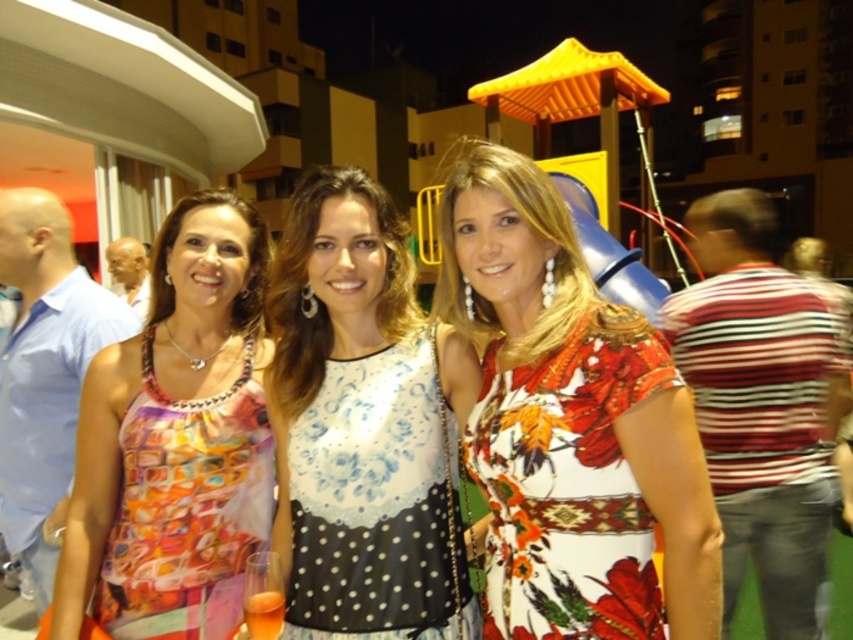
Is multicolored printed dress at center smaller than white lace tank top at center?

Incorrect, multicolored printed dress at center is not smaller in size than white lace tank top at center.

Between multicolored printed dress at center and white lace tank top at center, which one is positioned higher?

Positioned higher is multicolored printed dress at center.

Is point (78, 472) behind point (421, 388)?

Yes, point (78, 472) is farther from viewer.

Identify the location of multicolored printed dress at center. Image resolution: width=853 pixels, height=640 pixels. (177, 442).

Is point (474, 212) positioned before point (219, 598)?

That is True.

The width and height of the screenshot is (853, 640). What do you see at coordinates (569, 424) in the screenshot? I see `floral print dress at center` at bounding box center [569, 424].

Image resolution: width=853 pixels, height=640 pixels. Describe the element at coordinates (569, 424) in the screenshot. I see `floral print dress at center` at that location.

In order to click on floral print dress at center in this screenshot , I will do `click(569, 424)`.

Is floral print dress at center positioned before white lace tank top at center?

Yes, it is.

Between floral print dress at center and white lace tank top at center, which one has less height?

With less height is white lace tank top at center.

Is point (502, 628) positioned in front of point (445, 611)?

Yes, point (502, 628) is closer to viewer.

Where is `floral print dress at center`? floral print dress at center is located at coordinates (569, 424).